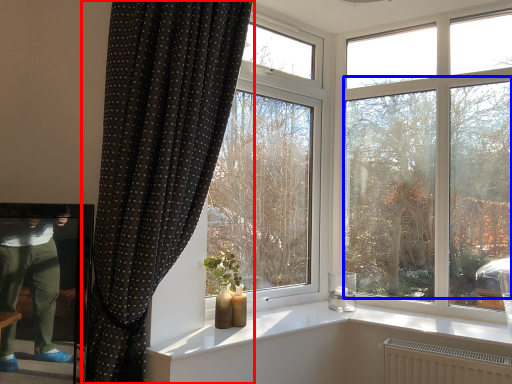
Question: Which object is further to the camera taking this photo, curtain (highlighted by a red box) or tree (highlighted by a blue box)?

Choices:
 (A) curtain
 (B) tree

Answer: (B)